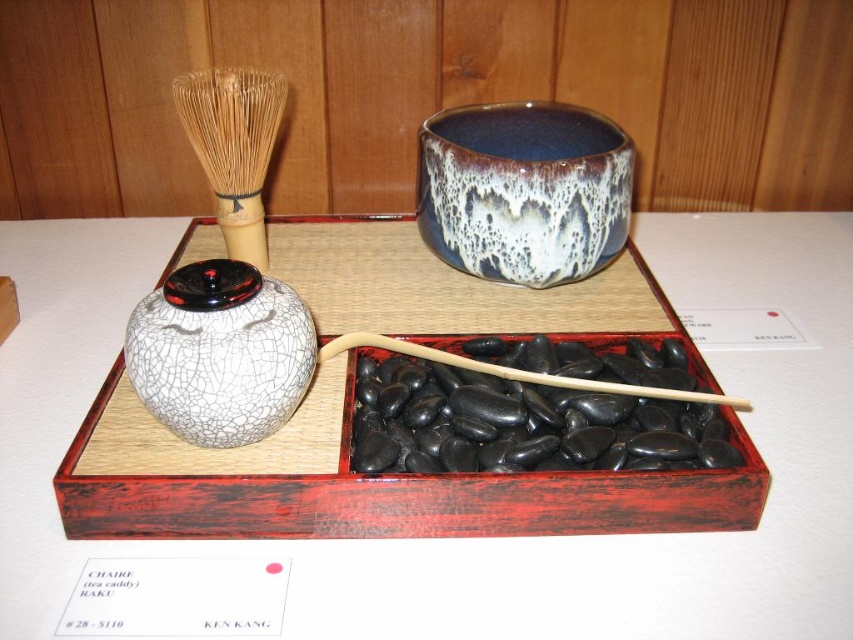
Question: Is cracked ceramic tea caddy at left further to camera compared to bamboo whisk at upper left?

Choices:
 (A) no
 (B) yes

Answer: (A)

Question: Which point is farther to the camera?

Choices:
 (A) (212, 276)
 (B) (392, 339)
 (C) (199, 81)

Answer: (C)

Question: Estimate the real-world distances between objects in this image. Which object is closer to the cracked ceramic jar at center-left?

Choices:
 (A) cracked ceramic tea caddy at left
 (B) bamboo whisk at upper left
 (C) speckled ceramic bowl at center

Answer: (A)

Question: Can you confirm if cracked ceramic tea caddy at left is positioned to the left of speckled ceramic bowl at center?

Choices:
 (A) yes
 (B) no

Answer: (A)

Question: Is cracked ceramic tea caddy at left above speckled ceramic bowl at center?

Choices:
 (A) no
 (B) yes

Answer: (A)

Question: Which point is closer to the camera?

Choices:
 (A) (582, 381)
 (B) (286, 84)
 (C) (517, 269)
 (D) (688, 573)

Answer: (D)